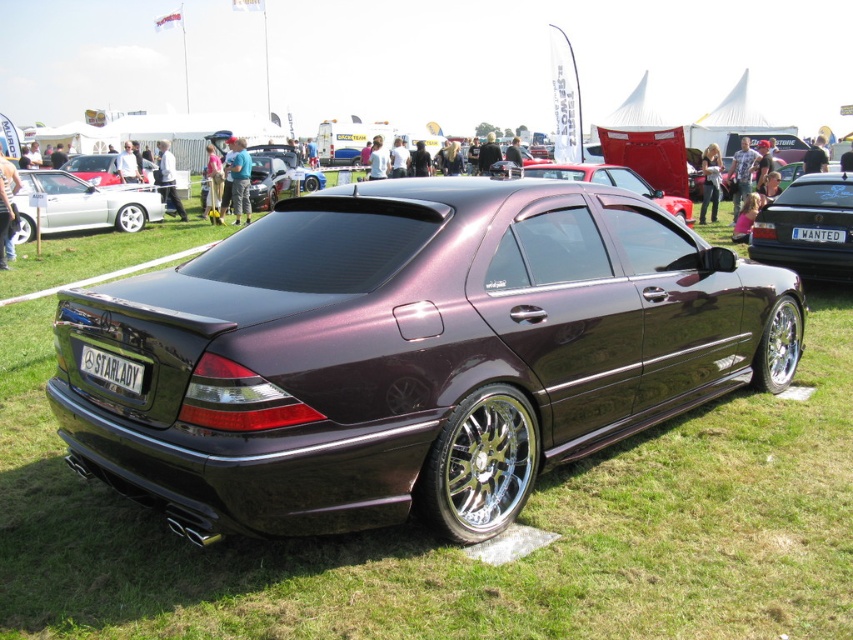
You are standing at the edge of a grassy field where a metallic maroon sedan at center is parked. If you want to take a closer look at the license plate reading

The metallic maroon sedan at center is 8.75 meters away from you, so you need to walk approximately 8.75 meters forward to reach it and read the license plate.

You are standing at the rear of the Mercedes sedan at the car show. You notice two points marked on the car. The first point is at coordinate point(848,256) and the second is at point(798,230). If you were to walk towards the front of the car, which point would you encounter first?

Point(848,256) is in front of point(798,230), so you would encounter point(848,256) first as you walk towards the front of the car.

You are a photographer at the car show and need to capture both the metallic maroon sedan at center and the metallic purple car at center in a single shot. Which car should you position closer to the left side of your camera frame to ensure both are visible?

You should position the metallic purple car at center closer to the left side of your camera frame because the metallic maroon sedan at center is already on its right side, so moving the purple car left will help both fit within the frame.